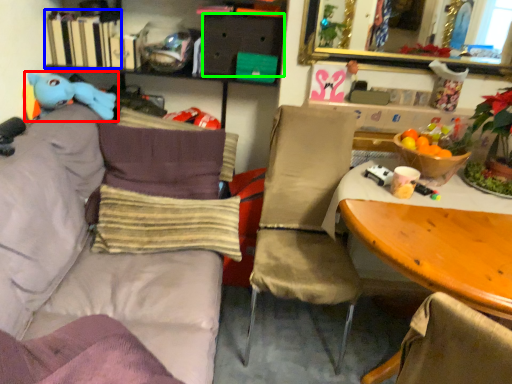
Question: Considering the real-world distances, which object is closest to toy (highlighted by a red box)? book (highlighted by a blue box) or drawer (highlighted by a green box).

Choices:
 (A) book
 (B) drawer

Answer: (A)